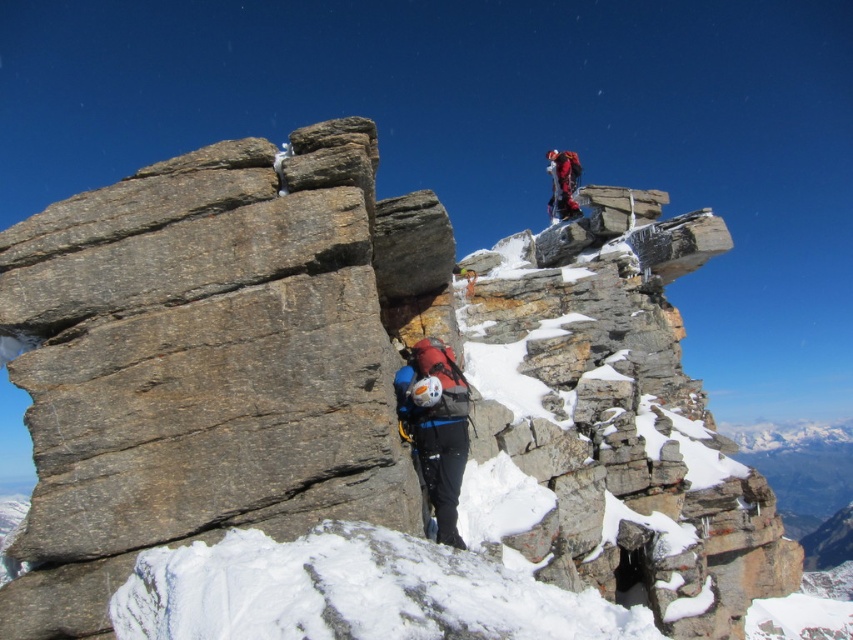
Is matte blue helmet at center to the left of red fabric jacket at upper center from the viewer's perspective?

Correct, you'll find matte blue helmet at center to the left of red fabric jacket at upper center.

Does matte blue helmet at center come in front of red fabric jacket at upper center?

Yes.

Is point (421, 374) behind point (555, 212)?

No, it is in front of (555, 212).

Find the location of a particular element. This screenshot has height=640, width=853. matte blue helmet at center is located at coordinates (436, 428).